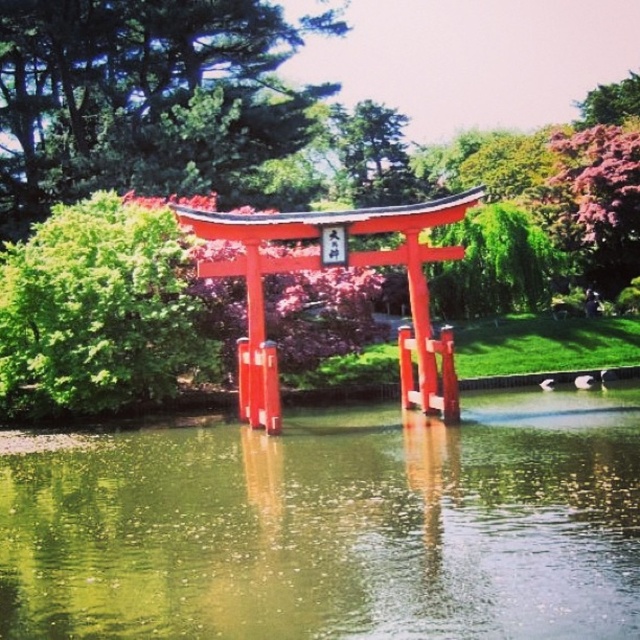
Who is more forward, (x=300, y=102) or (x=97, y=211)?

Point (x=97, y=211) is in front.

Which is more to the left, green leafy tree at upper center or green leafy bush at left?

From the viewer's perspective, green leafy tree at upper center appears more on the left side.

Which is behind, point (113, 154) or point (124, 337)?

The point (113, 154) is more distant.

Locate an element on the screen. green leafy tree at upper center is located at coordinates (141, 97).

Who is shorter, purple leafy tree at upper right or pink textured foliage at upper right?

With less height is purple leafy tree at upper right.

In the scene shown: Does purple leafy tree at upper right have a smaller size compared to pink textured foliage at upper right?

Indeed, purple leafy tree at upper right has a smaller size compared to pink textured foliage at upper right.

Does point (616, 280) lie in front of point (604, 100)?

Yes.

Where is `purple leafy tree at upper right`? This screenshot has height=640, width=640. purple leafy tree at upper right is located at coordinates (596, 202).

Can you confirm if green reflective water at center is positioned above green leafy bush at left?

Incorrect, green reflective water at center is not positioned above green leafy bush at left.

Is green reflective water at center thinner than green leafy bush at left?

No, green reflective water at center is not thinner than green leafy bush at left.

I want to click on green reflective water at center, so click(x=336, y=528).